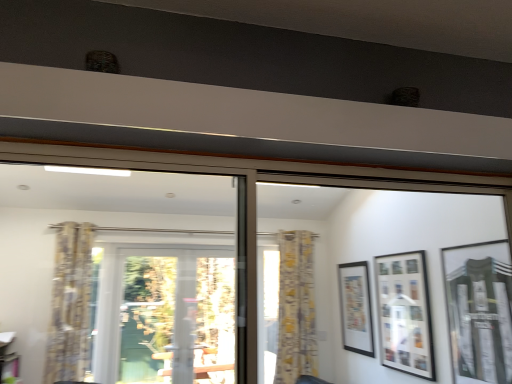
Question: Is matte glass picture frame at right, marked as the 3th picture frame in a back-to-front arrangement, inside the boundaries of yellow floral fabric curtain at center, placed as the first curtain when sorted from right to left, or outside?

Choices:
 (A) outside
 (B) inside

Answer: (A)

Question: In terms of size, does matte glass picture frame at right, which is the first picture frame from front to back, appear bigger or smaller than yellow floral fabric curtain at center, placed as the 1th curtain when sorted from back to front?

Choices:
 (A) big
 (B) small

Answer: (B)

Question: Which object is the closest to the matte black picture frame at center right, the 1th picture frame when ordered from back to front?

Choices:
 (A) yellow floral fabric curtain at left, the 2th curtain from the right
 (B) matte glass picture frame at right, the first picture frame from the right
 (C) transparent glass screen door at center
 (D) matte black picture frame at center right, which is the 2th picture frame from back to front
 (E) black matte window frame at upper center

Answer: (E)

Question: Estimate the real-world distances between objects in this image. Which object is closer to the transparent glass screen door at center?

Choices:
 (A) matte glass picture frame at right, the first picture frame from the right
 (B) yellow floral fabric curtain at center, placed as the 2th curtain when sorted from left to right
 (C) yellow floral fabric curtain at left, the first curtain in the left-to-right sequence
 (D) matte black picture frame at center right, the 1th picture frame when ordered from back to front
 (E) black matte window frame at upper center

Answer: (C)